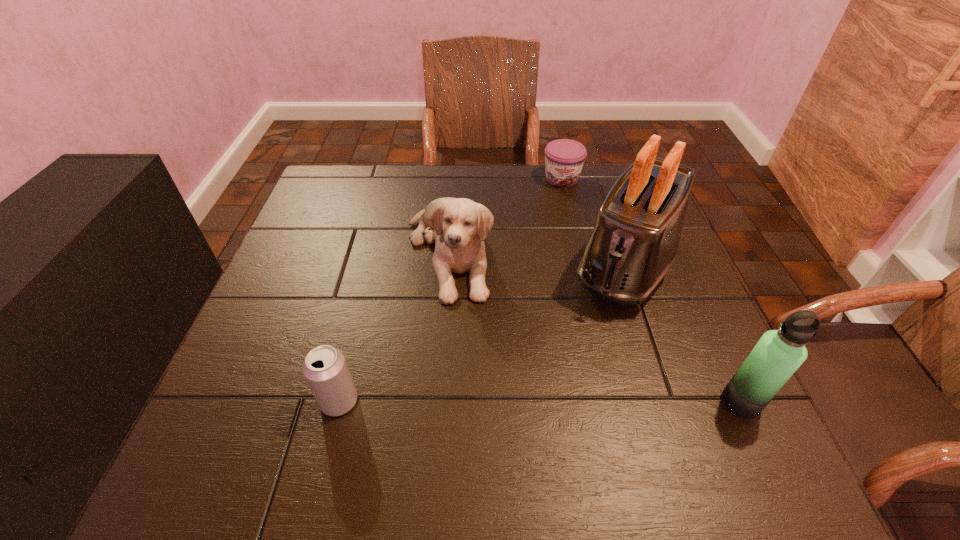
The height and width of the screenshot is (540, 960). Find the location of `vacant spot on the desktop that is between the beer can and the second tallest object and is positioned on the side of the toaster with the control lever`. vacant spot on the desktop that is between the beer can and the second tallest object and is positioned on the side of the toaster with the control lever is located at coordinates (544, 401).

The height and width of the screenshot is (540, 960). Identify the location of vacant space on the desktop that is between the beer can and the fourth shortest object and is positioned on the front label of the shortest object. (594, 401).

The height and width of the screenshot is (540, 960). Identify the location of vacant space on the desktop that is between the beer can and the second tallest object and is positioned on the front-facing side of the fourth object from right to left. (516, 401).